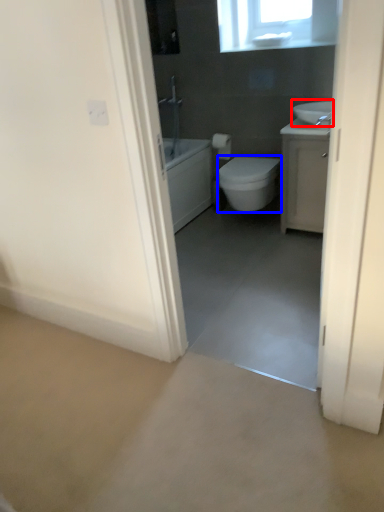
Question: Which of the following is the farthest to the observer, sink (highlighted by a red box) or bidet (highlighted by a blue box)?

Choices:
 (A) sink
 (B) bidet

Answer: (B)